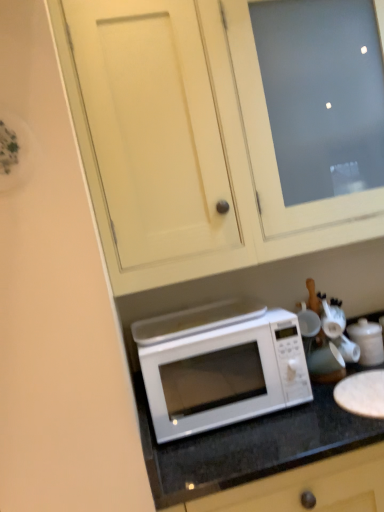
Question: Is white glossy teapot at right wider than white glossy microwave at lower center?

Choices:
 (A) no
 (B) yes

Answer: (A)

Question: From the image's perspective, is white glossy teapot at right below white glossy microwave at lower center?

Choices:
 (A) no
 (B) yes

Answer: (A)

Question: Is white glossy teapot at right completely or partially outside of white glossy microwave at lower center?

Choices:
 (A) yes
 (B) no

Answer: (B)

Question: From a real-world perspective, is white glossy teapot at right physically above white glossy microwave at lower center?

Choices:
 (A) yes
 (B) no

Answer: (A)

Question: Considering the relative sizes of white glossy teapot at right and white glossy microwave at lower center in the image provided, is white glossy teapot at right smaller than white glossy microwave at lower center?

Choices:
 (A) no
 (B) yes

Answer: (B)

Question: Is white glossy microwave at center inside the boundaries of white matte cabinet at upper center, or outside?

Choices:
 (A) outside
 (B) inside

Answer: (A)

Question: From a real-world perspective, is white glossy microwave at center physically located above or below white matte cabinet at upper center?

Choices:
 (A) above
 (B) below

Answer: (B)

Question: Visually, is white glossy microwave at center positioned to the left or to the right of white matte cabinet at upper center?

Choices:
 (A) right
 (B) left

Answer: (B)

Question: From the image's perspective, relative to white matte cabinet at upper center, is white glossy microwave at center above or below?

Choices:
 (A) above
 (B) below

Answer: (B)

Question: From the image's perspective, is white glossy microwave at center positioned above or below white matte microwave at center?

Choices:
 (A) above
 (B) below

Answer: (A)

Question: Is white glossy microwave at center taller or shorter than white matte microwave at center?

Choices:
 (A) short
 (B) tall

Answer: (A)

Question: Relative to white matte microwave at center, is white glossy microwave at center in front or behind?

Choices:
 (A) behind
 (B) front

Answer: (A)

Question: Does point (178, 327) appear closer or farther from the camera than point (256, 356)?

Choices:
 (A) closer
 (B) farther

Answer: (B)

Question: Is white glossy microwave at lower center to the left or to the right of white matte cabinet at upper center in the image?

Choices:
 (A) right
 (B) left

Answer: (A)

Question: Do you think white glossy microwave at lower center is within white matte cabinet at upper center, or outside of it?

Choices:
 (A) inside
 (B) outside

Answer: (B)